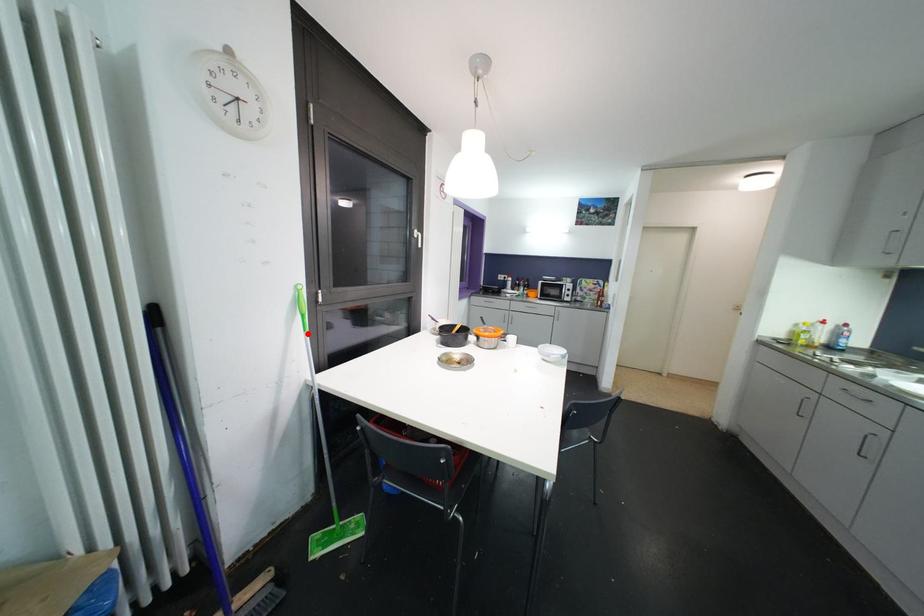
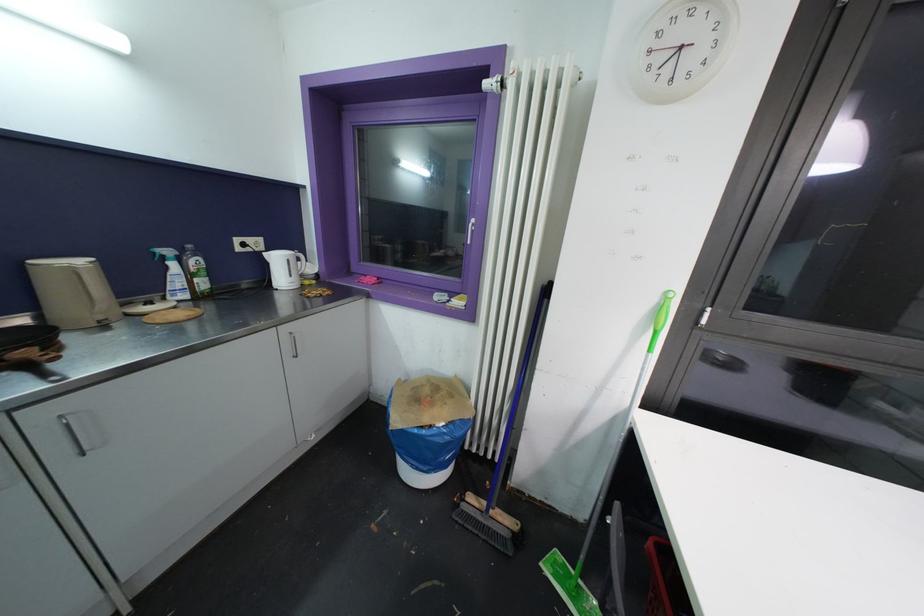
Find the pixel in the second image that matches the highlighted location in the first image.

(652, 354)